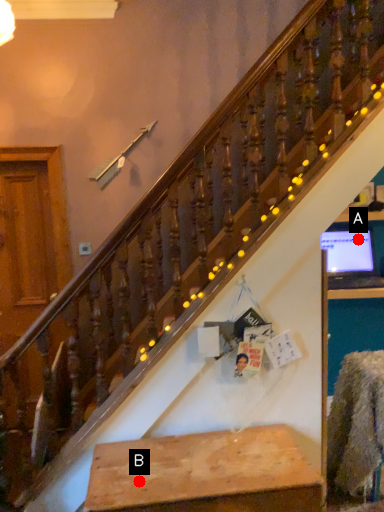
Question: Two points are circled on the image, labeled by A and B beside each circle. Which point appears closest to the camera in this image?

Choices:
 (A) A is closer
 (B) B is closer

Answer: (B)